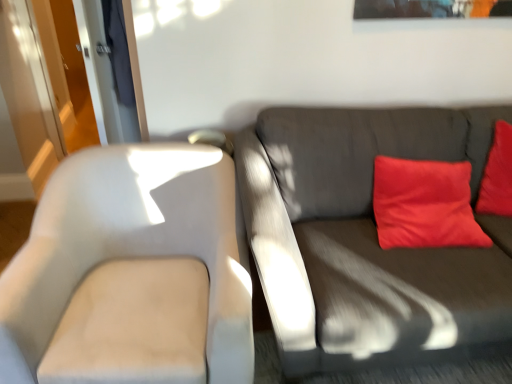
Measure the distance between matte red pillow at upper right and camera.

The depth of matte red pillow at upper right is 5.30 feet.

Locate an element on the screen. The image size is (512, 384). beige fabric chair at left is located at coordinates (127, 264).

Find the location of `matte red pillow at upper right`. matte red pillow at upper right is located at coordinates (424, 204).

Measure the distance between matte red pillow at upper right and beige fabric chair at left.

The distance of matte red pillow at upper right from beige fabric chair at left is 34.44 inches.

Is matte red pillow at upper right next to beige fabric chair at left and touching it?

No, matte red pillow at upper right is not beside beige fabric chair at left.

Between matte red pillow at upper right and beige fabric chair at left, which one has smaller width?

With smaller width is matte red pillow at upper right.

Is matte red pillow at upper right not within beige fabric chair at left?

Yes, matte red pillow at upper right is outside of beige fabric chair at left.

Is transparent glass door at upper left further to the viewer compared to beige fabric chair at left?

Yes, the depth of transparent glass door at upper left is greater than that of beige fabric chair at left.

Measure the distance from transparent glass door at upper left to beige fabric chair at left.

1.12 meters.

Do you think transparent glass door at upper left is within beige fabric chair at left, or outside of it?

The correct answer is: outside.

Which is behind, point (145, 127) or point (77, 227)?

Point (145, 127)

The width and height of the screenshot is (512, 384). I want to click on chair below the dark gray fabric couch at right (from a real-world perspective), so 127,264.

Does dark gray fabric couch at right contain beige fabric chair at left?

That's incorrect, beige fabric chair at left is not inside dark gray fabric couch at right.

Consider the image. Is dark gray fabric couch at right closer to the viewer compared to beige fabric chair at left?

No, dark gray fabric couch at right is behind beige fabric chair at left.

Is dark gray fabric couch at right facing towards beige fabric chair at left?

No, dark gray fabric couch at right is not facing towards beige fabric chair at left.

Would you say beige fabric chair at left is inside or outside matte red pillow at upper right?

beige fabric chair at left is outside matte red pillow at upper right.

Between beige fabric chair at left and matte red pillow at upper right, which one is positioned behind?

matte red pillow at upper right is further away from the camera.

Locate an element on the screen. This screenshot has height=384, width=512. chair in front of the matte red pillow at upper right is located at coordinates (127, 264).

Considering the relative positions of beige fabric chair at left and matte red pillow at upper right in the image provided, is beige fabric chair at left to the left of matte red pillow at upper right from the viewer's perspective?

Yes.

Is matte red pillow at upper right located outside dark gray fabric couch at right?

No, most part of matte red pillow at upper right lies within dark gray fabric couch at right.

From the picture: Can you confirm if matte red pillow at upper right is taller than dark gray fabric couch at right?

No.

Based on their positions, is matte red pillow at upper right located to the left or right of dark gray fabric couch at right?

In the image, matte red pillow at upper right appears on the left side of dark gray fabric couch at right.

Who is bigger, matte red pillow at upper right or dark gray fabric couch at right?

Bigger between the two is dark gray fabric couch at right.

Can you confirm if dark gray fabric couch at right is bigger than transparent glass door at upper left?

Yes, dark gray fabric couch at right is bigger than transparent glass door at upper left.

Which is closer, (367,336) or (141,113)?

Point (367,336) is positioned closer to the camera compared to point (141,113).

Which is more to the left, dark gray fabric couch at right or transparent glass door at upper left?

From the viewer's perspective, transparent glass door at upper left appears more on the left side.

Considering the positions of points (108, 86) and (422, 224), is point (108, 86) closer to camera compared to point (422, 224)?

No, (108, 86) is behind (422, 224).

Does transparent glass door at upper left have a larger size compared to matte red pillow at upper right?

Actually, transparent glass door at upper left might be smaller than matte red pillow at upper right.

Looking at this image, would you say matte red pillow at upper right is part of transparent glass door at upper left's contents?

Definitely not — matte red pillow at upper right is not inside transparent glass door at upper left.

Locate an element on the screen. chair below the matte red pillow at upper right (from a real-world perspective) is located at coordinates (127, 264).

You are a GUI agent. You are given a task and a screenshot of the screen. Output one action in this format:
    pyautogui.click(x=<x>, y=<y>)
    Task: Click on the chair located on the right of transparent glass door at upper left
    The height and width of the screenshot is (384, 512).
    Given the screenshot: What is the action you would take?
    tap(127, 264)

Looking at the image, which one is located further to transparent glass door at upper left, dark gray fabric couch at right or beige fabric chair at left?

dark gray fabric couch at right is further to transparent glass door at upper left.

Looking at the image, which one is located closer to transparent glass door at upper left, matte red pillow at upper right or beige fabric chair at left?

beige fabric chair at left.

From the image, which object appears to be nearer to dark gray fabric couch at right, transparent glass door at upper left or matte red pillow at upper right?

matte red pillow at upper right.

Considering their positions, is beige fabric chair at left positioned closer to dark gray fabric couch at right than transparent glass door at upper left?

beige fabric chair at left.

Looking at the image, which one is located closer to beige fabric chair at left, matte red pillow at upper right or transparent glass door at upper left?

matte red pillow at upper right lies closer to beige fabric chair at left than the other object.

Which object lies nearer to the anchor point matte red pillow at upper right, dark gray fabric couch at right or transparent glass door at upper left?

Among the two, dark gray fabric couch at right is located nearer to matte red pillow at upper right.

Estimate the real-world distances between objects in this image. Which object is closer to matte red pillow at upper right, transparent glass door at upper left or beige fabric chair at left?

beige fabric chair at left is closer to matte red pillow at upper right.

Looking at the image, which one is located closer to matte red pillow at upper right, beige fabric chair at left or dark gray fabric couch at right?

dark gray fabric couch at right.

You are a GUI agent. You are given a task and a screenshot of the screen. Output one action in this format:
    pyautogui.click(x=<x>, y=<y>)
    Task: Click on the chair situated between transparent glass door at upper left and dark gray fabric couch at right from left to right
    Image resolution: width=512 pixels, height=384 pixels.
    Given the screenshot: What is the action you would take?
    pyautogui.click(x=127, y=264)

Locate an element on the screen. pillow situated between beige fabric chair at left and dark gray fabric couch at right from left to right is located at coordinates (424, 204).

Where is `pillow between transparent glass door at upper left and dark gray fabric couch at right in the horizontal direction`? pillow between transparent glass door at upper left and dark gray fabric couch at right in the horizontal direction is located at coordinates (424, 204).

Locate an element on the screen. The height and width of the screenshot is (384, 512). chair between transparent glass door at upper left and matte red pillow at upper right is located at coordinates (127, 264).